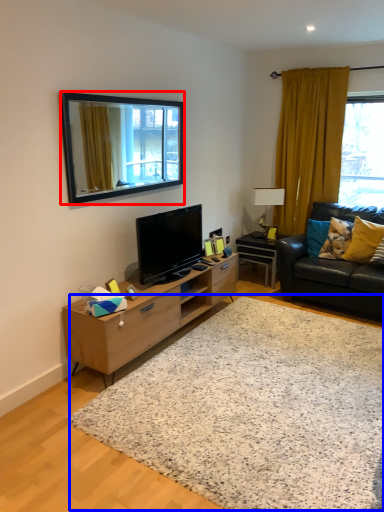
Question: Which object is closer to the camera taking this photo, mirror (highlighted by a red box) or plain (highlighted by a blue box)?

Choices:
 (A) mirror
 (B) plain

Answer: (B)